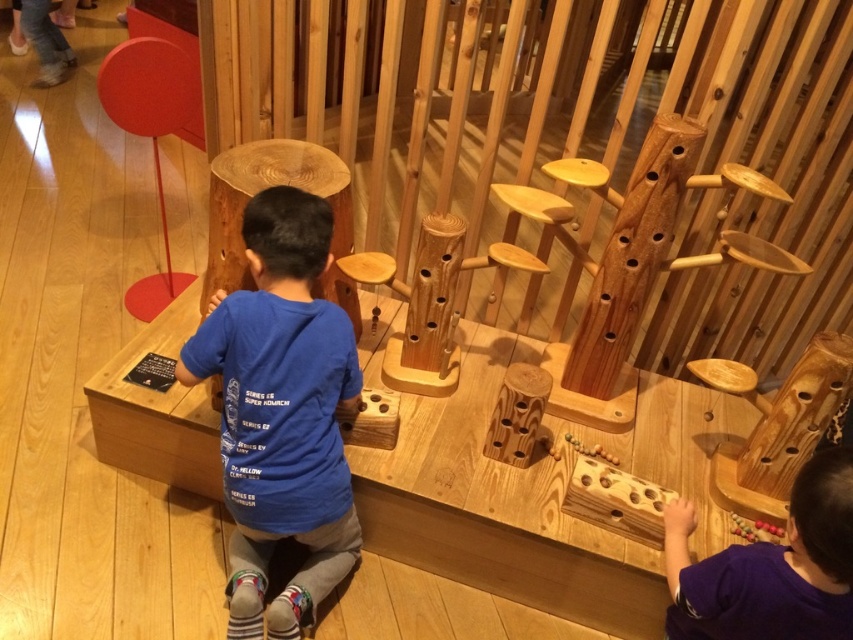
You are a parent looking at two shirts in a store. The blue cotton shirt at center and the purple matte shirt at lower right. Which shirt is positioned more to the left side?

The blue cotton shirt at center is positioned to the left of the purple matte shirt at lower right, so the blue cotton shirt at center is more to the left.

Consider the image. You are a parent trying to choose between two shirts for your child to wear during a play session. The blue cotton shirt at center and the purple matte shirt at lower right are both available. Based on the image, which shirt might allow your child more comfort while moving around the wooden play structure?

The blue cotton shirt at center might allow more comfort since it is wider than the purple matte shirt at lower right, providing better ease of movement.